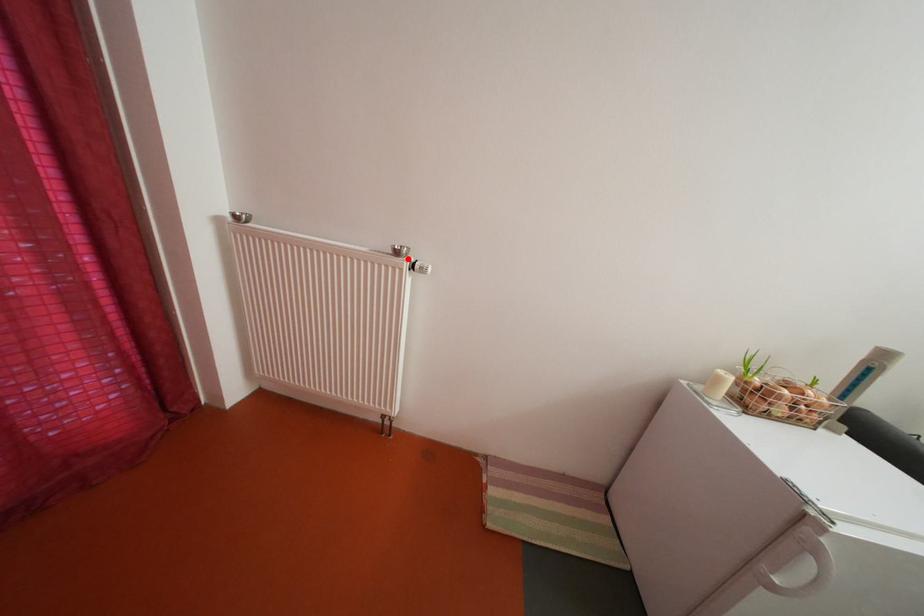
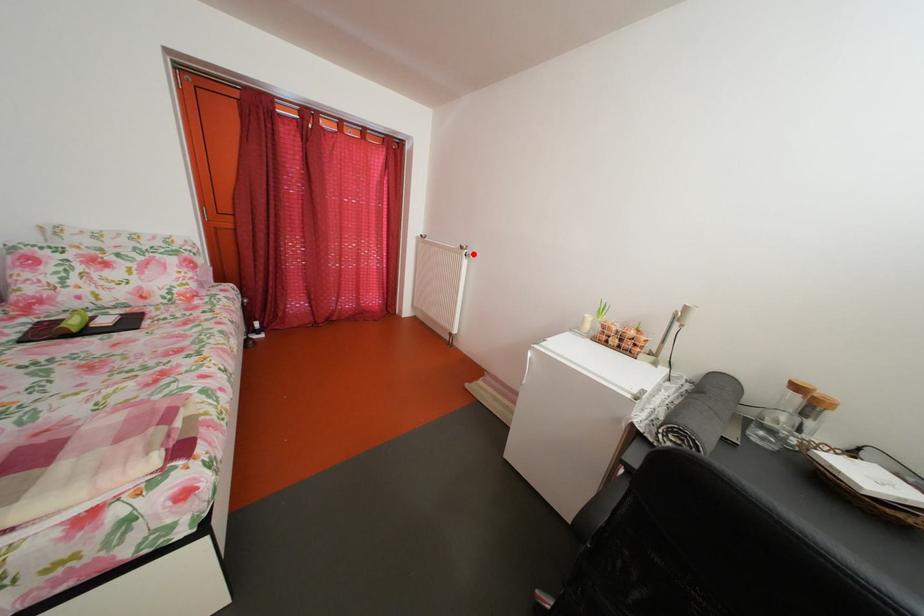
In the scene shown: I am providing you with two images of the same scene from different viewpoints. A red point is marked on the first image and another point is marked on the second image. Is the red point in image1 aligned with the point shown in image2?

Yes